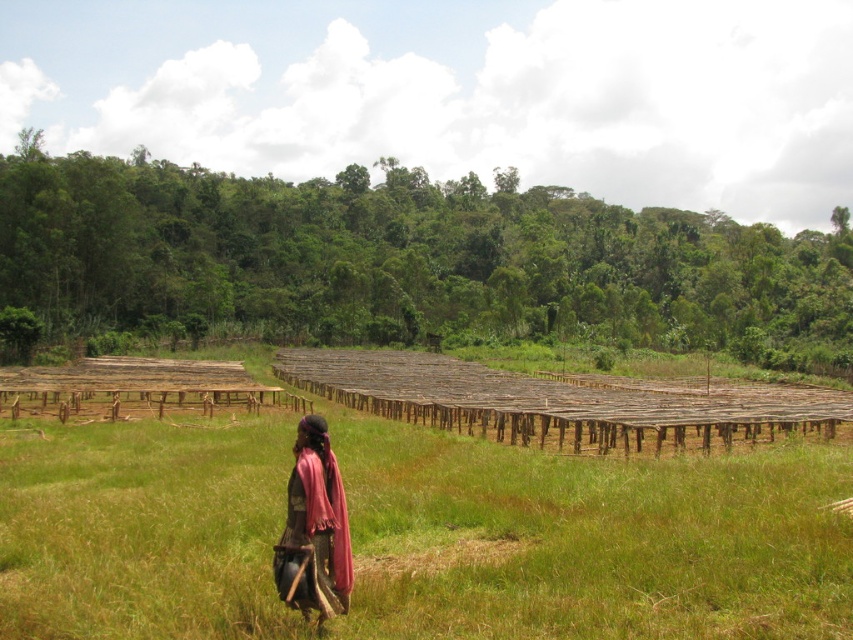
Question: Which object is closer to the camera taking this photo?

Choices:
 (A) brown wooden racks at center
 (B) dark brown fabric at center

Answer: (A)

Question: Does brown wooden racks at center appear under dark brown fabric at center?

Choices:
 (A) yes
 (B) no

Answer: (A)

Question: From the image, what is the correct spatial relationship of brown wooden racks at center in relation to dark brown fabric at center?

Choices:
 (A) left
 (B) right

Answer: (A)

Question: Where is brown wooden racks at center located in relation to dark brown fabric at center in the image?

Choices:
 (A) above
 (B) below

Answer: (B)

Question: Which point appears farthest from the camera in this image?

Choices:
 (A) (141, 566)
 (B) (317, 433)

Answer: (A)